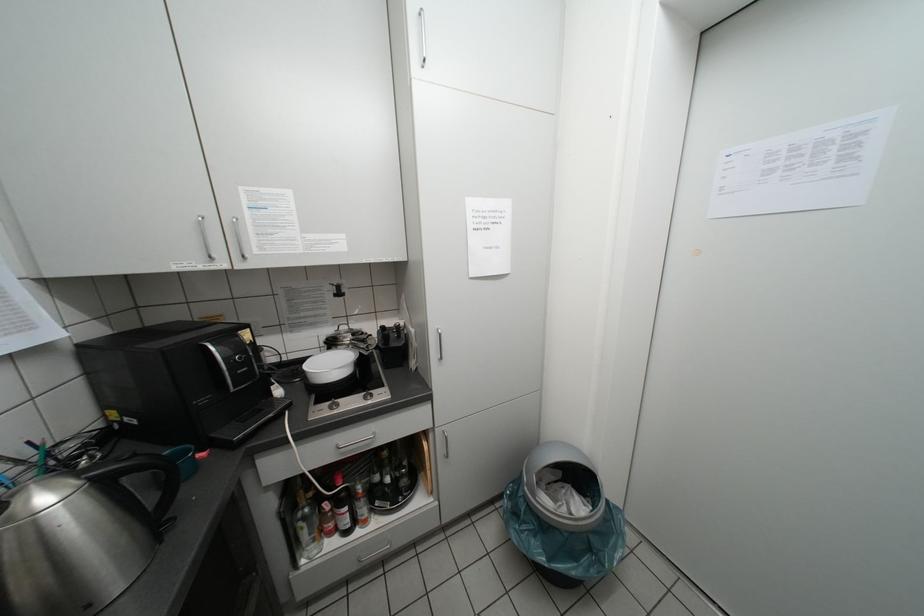
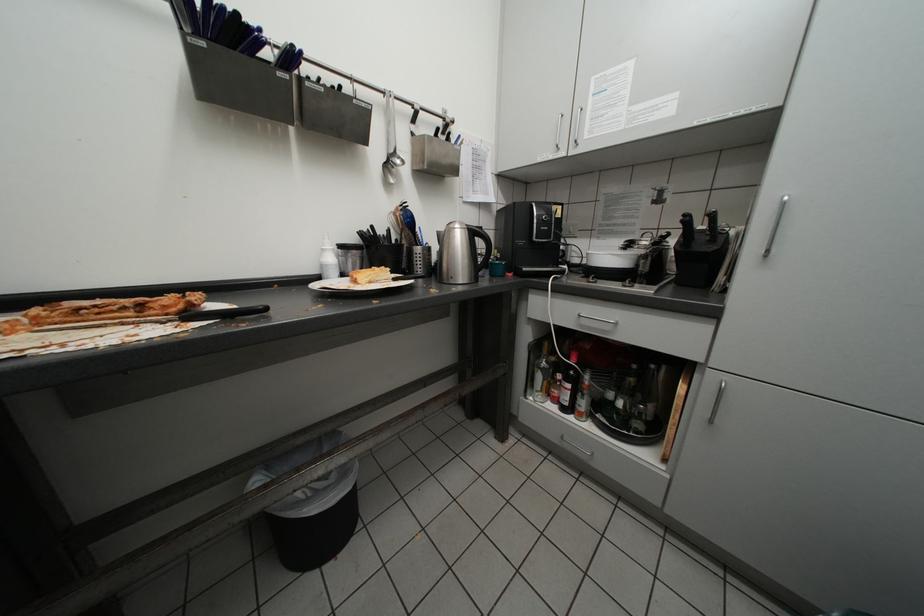
Question: The camera is either moving clockwise (left) or counter-clockwise (right) around the object. The first image is from the beginning of the video and the second image is from the end. Is the camera moving left or right when shooting the video?

Choices:
 (A) Left
 (B) Right

Answer: (B)